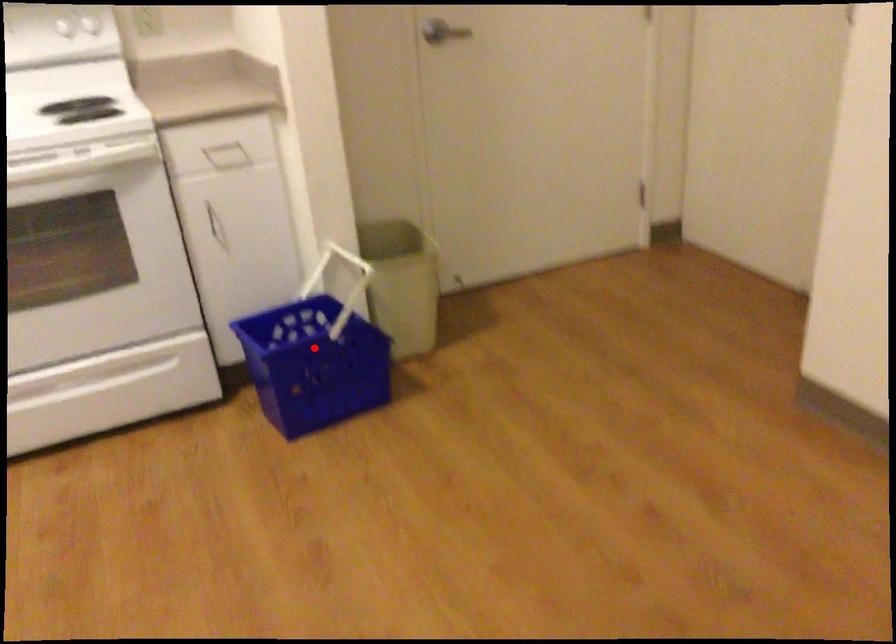
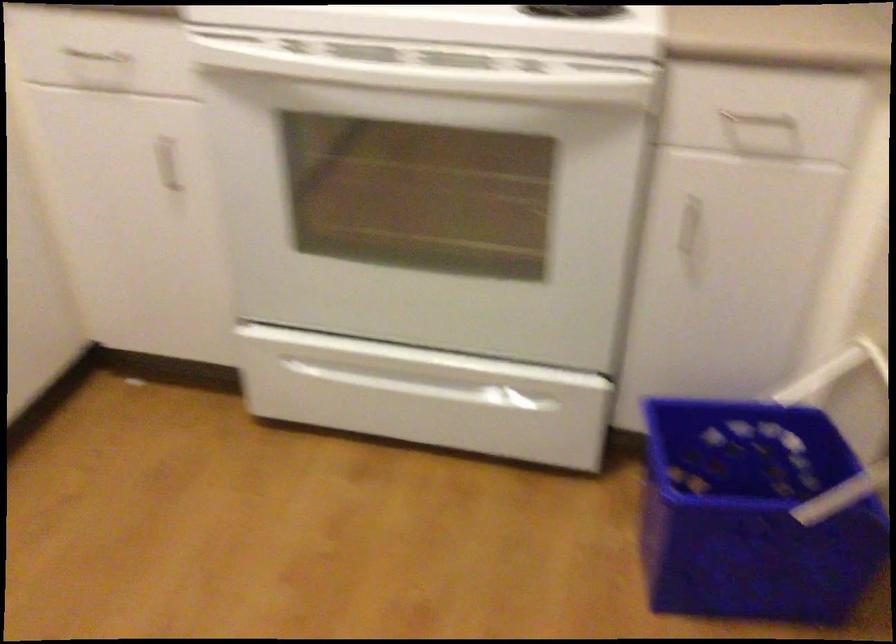
In the second image, find the point that corresponds to the highlighted location in the first image.

(752, 514)